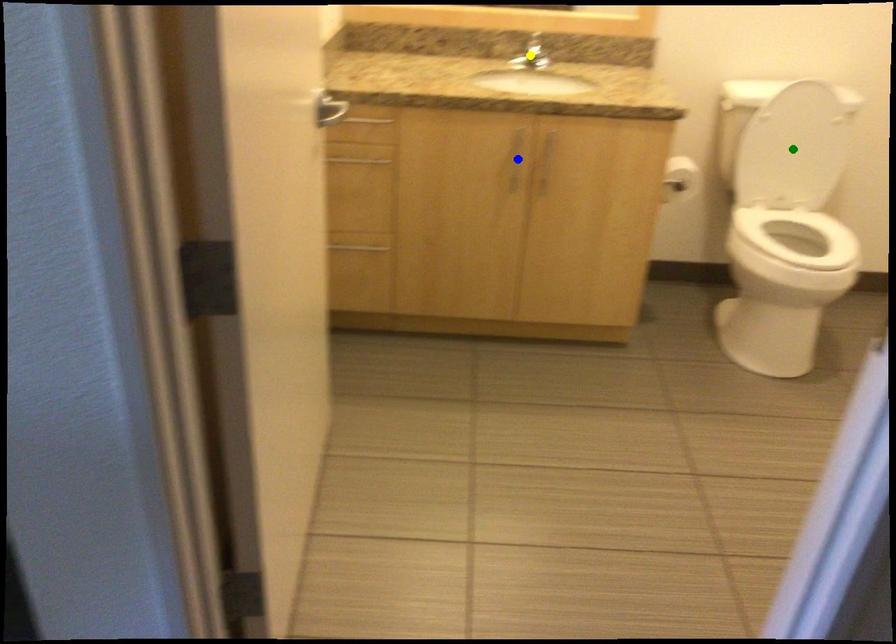
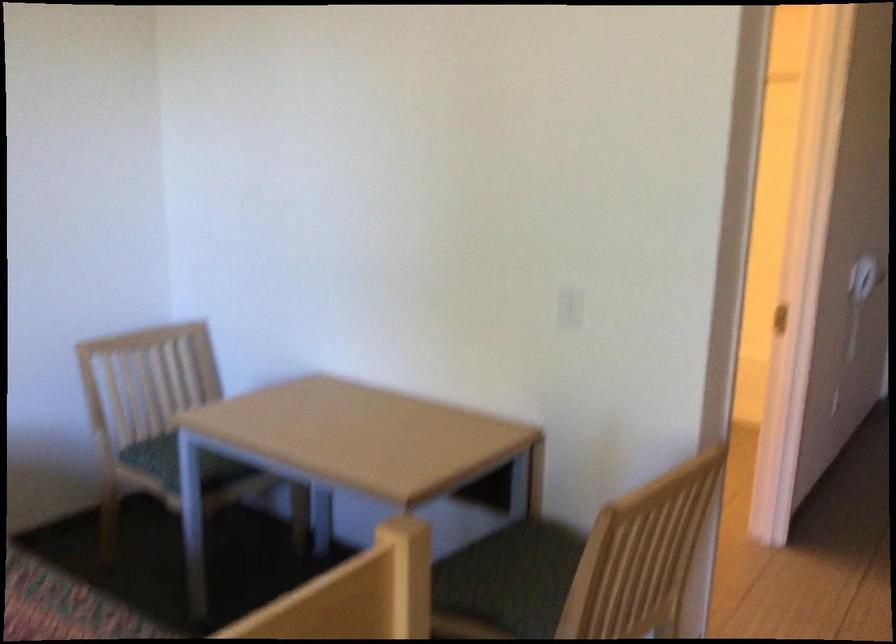
I am providing you with two images of the same scene from different viewpoints. Three points are marked in image1. Which point corresponds to a part or object that is occluded in image2?In image1, three points are marked. Which of them correspond to a part or object that is occluded in image2?Among the three points shown in image1, which one corresponds to a part or object that is no longer visible due to occlusion in image2?

Invisible in image2: blue point, yellow point, green point.